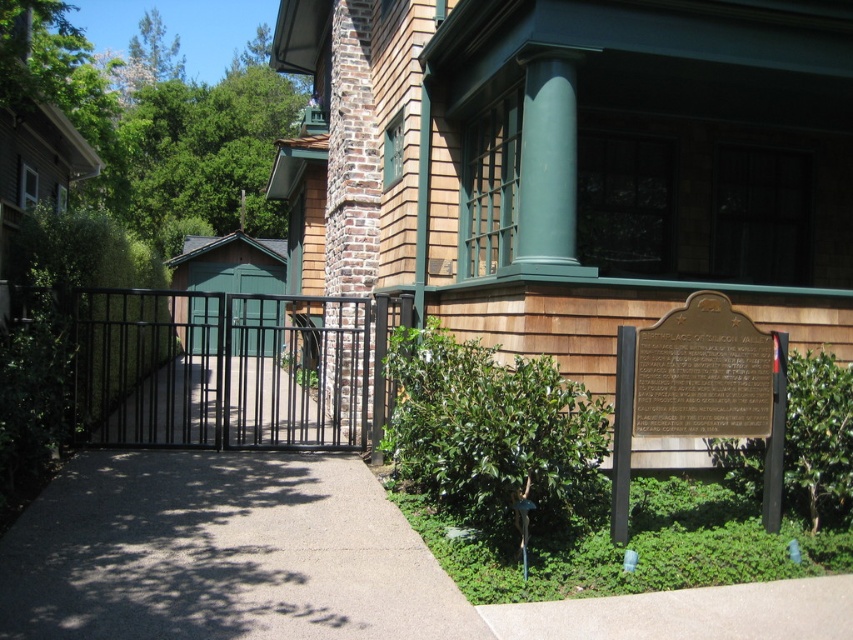
Question: Which point appears farthest from the camera in this image?

Choices:
 (A) (169, 609)
 (B) (273, 346)

Answer: (B)

Question: Which object appears farthest from the camera in this image?

Choices:
 (A) gray concrete pavement at center
 (B) black metal gate at center
 (C) green wood gate at center

Answer: (C)

Question: Estimate the real-world distances between objects in this image. Which object is closer to the green wood gate at center?

Choices:
 (A) gray concrete pavement at center
 (B) black metal gate at center

Answer: (B)

Question: Does gray concrete pavement at center appear under green wood gate at center?

Choices:
 (A) yes
 (B) no

Answer: (A)

Question: Observing the image, what is the correct spatial positioning of gray concrete pavement at center in reference to black metal gate at center?

Choices:
 (A) above
 (B) below

Answer: (B)

Question: Does black metal gate at center have a larger size compared to green wood gate at center?

Choices:
 (A) yes
 (B) no

Answer: (A)